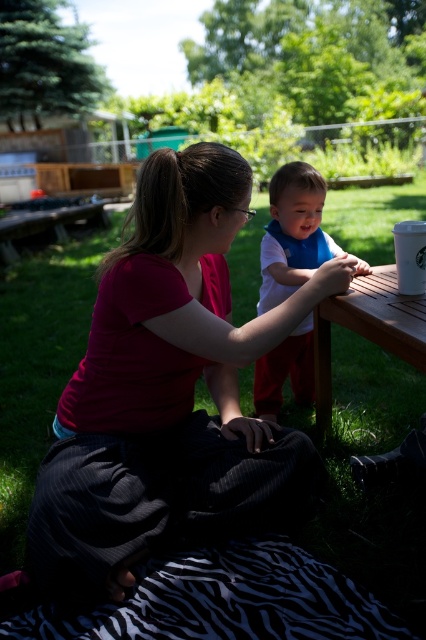
What object is located at the coordinates point (293,234) in the image?

The point (293,234) corresponds to the white matte bib at center.

You are a photographer setting up a shot of the scene described. You need to place a prop exactly at the center of the image. However, there is already a white matte bib at center. Can you confirm if the bib is positioned at the exact center coordinates of the image?

The white matte bib at center is located at point (293, 234), which is not the exact center of the image. The exact center would be at (213, 320). Therefore, the bib is slightly off to the left and lower than the true center.